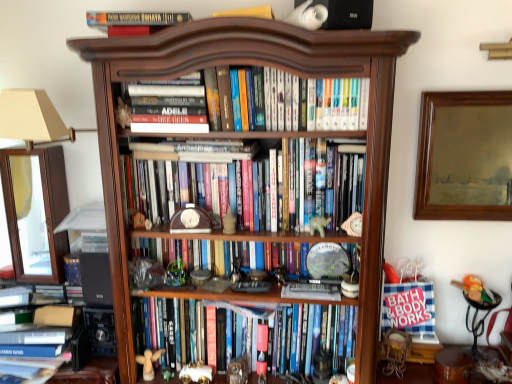
Measure the distance between point (415, 289) and camera.

The depth of point (415, 289) is 1.68 meters.

Identify the location of matte white figurine at center, the fourth toy positioned from the bottom. (350, 285).

In order to click on hardcover book at center, positioned as the 3th book in top-to-bottom order in this screenshot , I will do (168, 105).

The width and height of the screenshot is (512, 384). What do you see at coordinates (464, 156) in the screenshot?
I see `wooden picture frame at upper right` at bounding box center [464, 156].

The width and height of the screenshot is (512, 384). What do you see at coordinates (319, 225) in the screenshot?
I see `white matte bear at center, the second toy when ordered from right to left` at bounding box center [319, 225].

What do you see at coordinates (229, 222) in the screenshot?
I see `matte brown vase at center, arranged as the 4th toy when viewed from the right` at bounding box center [229, 222].

You are a GUI agent. You are given a task and a screenshot of the screen. Output one action in this format:
    pyautogui.click(x=<x>, y=<y>)
    Task: Click on the brown wooden figurine at center, which appears as the fifth toy when viewed from the left
    
    Given the screenshot: What is the action you would take?
    [x=238, y=371]

Is wooden picture frame at upper right facing away from brown wooden clock at center?

No, wooden picture frame at upper right is not facing away from brown wooden clock at center.

Considering the sizes of objects wooden picture frame at upper right and brown wooden clock at center in the image provided, who is wider, wooden picture frame at upper right or brown wooden clock at center?

Wider between the two is wooden picture frame at upper right.

Is wooden picture frame at upper right located outside brown wooden clock at center?

Indeed, wooden picture frame at upper right is completely outside brown wooden clock at center.

Is wooden picture frame at upper right positioned behind brown wooden clock at center?

Yes, it is behind brown wooden clock at center.

Considering the relative sizes of hardcover book at top, which is the first book from top to bottom, and wooden clock at center, marked as the 2th book in a bottom-to-top arrangement, in the image provided, is hardcover book at top, which is the first book from top to bottom, bigger than wooden clock at center, marked as the 2th book in a bottom-to-top arrangement,?

No.

Between hardcover book at top, the sixth book in the bottom-to-top sequence, and wooden clock at center, which is the fifth book from top to bottom, which one has less height?

hardcover book at top, the sixth book in the bottom-to-top sequence.

Is hardcover book at top, which is the first book from top to bottom, with wooden clock at center, which is the fifth book from top to bottom?

No, hardcover book at top, which is the first book from top to bottom, is not with wooden clock at center, which is the fifth book from top to bottom.

Considering the points (98, 12) and (161, 248), which point is in front, point (98, 12) or point (161, 248)?

The point (98, 12) is more forward.

Considering the relative sizes of wooden picture frame at upper right and wooden clock at center, marked as the 2th book in a bottom-to-top arrangement, in the image provided, is wooden picture frame at upper right smaller than wooden clock at center, marked as the 2th book in a bottom-to-top arrangement,?

Yes, wooden picture frame at upper right is smaller than wooden clock at center, marked as the 2th book in a bottom-to-top arrangement.

From the image's perspective, is wooden picture frame at upper right over wooden clock at center, marked as the 2th book in a bottom-to-top arrangement?

Yes, from the image's perspective, wooden picture frame at upper right is above wooden clock at center, marked as the 2th book in a bottom-to-top arrangement.

Considering the relative sizes of wooden picture frame at upper right and wooden clock at center, which is the fifth book from top to bottom, in the image provided, is wooden picture frame at upper right wider than wooden clock at center, which is the fifth book from top to bottom,?

Incorrect, the width of wooden picture frame at upper right does not surpass that of wooden clock at center, which is the fifth book from top to bottom.

Is dark wood bookcase at center far away from brown wooden figurine at upper left, the first toy viewed from the top?

Actually, dark wood bookcase at center and brown wooden figurine at upper left, the first toy viewed from the top, are a little close together.

Does point (381, 114) come farther from viewer compared to point (126, 109)?

No.

Can you confirm if dark wood bookcase at center is smaller than brown wooden figurine at upper left, which appears as the 7th toy when viewed from the right?

No, dark wood bookcase at center is not smaller than brown wooden figurine at upper left, which appears as the 7th toy when viewed from the right.

Is dark wood bookcase at center oriented away from brown wooden figurine at upper left, which appears as the 7th toy when viewed from the right?

Absolutely, dark wood bookcase at center is directed away from brown wooden figurine at upper left, which appears as the 7th toy when viewed from the right.

What's the angular difference between dark wood bookcase at center and hardcover book at top, which is the first book from top to bottom,'s facing directions?

They differ by 10.5 degrees in their facing directions.

Locate an element on the screen. The image size is (512, 384). bookcase below the hardcover book at top, the sixth book in the bottom-to-top sequence (from the image's perspective) is located at coordinates (261, 64).

From their relative heights in the image, would you say dark wood bookcase at center is taller or shorter than hardcover book at top, the sixth book in the bottom-to-top sequence?

dark wood bookcase at center is taller than hardcover book at top, the sixth book in the bottom-to-top sequence.

From a real-world perspective, between dark wood bookcase at center and hardcover book at top, the sixth book in the bottom-to-top sequence, who is vertically lower?

dark wood bookcase at center, from a real-world perspective.

Between brown wooden figurine at upper left, the first toy viewed from the top, and white paper at lower right, which one has smaller size?

brown wooden figurine at upper left, the first toy viewed from the top.

Does brown wooden figurine at upper left, the 1th toy in the left-to-right sequence, have a greater width compared to white paper at lower right?

No.

From a real-world perspective, which is physically above, brown wooden figurine at upper left, the first toy viewed from the top, or white paper at lower right?

brown wooden figurine at upper left, the first toy viewed from the top, is physically above.

Is brown wooden figurine at upper left, the first toy viewed from the top, positioned before white paper at lower right?

Yes, the depth of brown wooden figurine at upper left, the first toy viewed from the top, is less than that of white paper at lower right.

Is wooden picture frame at upper right not near white matte bear at center, which is the third toy from top to bottom?

No, there isn't a large distance between wooden picture frame at upper right and white matte bear at center, which is the third toy from top to bottom.

Does wooden picture frame at upper right contain white matte bear at center, the second toy when ordered from right to left?

Actually, white matte bear at center, the second toy when ordered from right to left, is outside wooden picture frame at upper right.

Considering the sizes of objects wooden picture frame at upper right and white matte bear at center, which is the 6th toy in left-to-right order, in the image provided, who is smaller, wooden picture frame at upper right or white matte bear at center, which is the 6th toy in left-to-right order,?

Smaller between the two is white matte bear at center, which is the 6th toy in left-to-right order.

The height and width of the screenshot is (384, 512). What are the coordinates of `picture frame that is on the right side of brown wooden clock at center` in the screenshot? It's located at (464, 156).

Where is `the 4th book below the hardcover book at top, the sixth book in the bottom-to-top sequence (from a real-world perspective)`? the 4th book below the hardcover book at top, the sixth book in the bottom-to-top sequence (from a real-world perspective) is located at coordinates 226,254.

From the image, which object appears to be farther from dark wood bookcase at center, transparent glass cabinet at left or white paper at lower right?

Based on the image, transparent glass cabinet at left appears to be further to dark wood bookcase at center.

In the scene shown: When comparing their distances from brown wooden figurine at upper left, the first toy viewed from the top, does hardcover book at center, positioned as the 3th book in top-to-bottom order, or wooden angel at lower center, placed as the 2th toy when sorted from left to right, seem closer?

hardcover book at center, positioned as the 3th book in top-to-bottom order, is positioned closer to the anchor brown wooden figurine at upper left, the first toy viewed from the top.

Based on their spatial positions, is white plush toy at lower center, placed as the 5th toy when sorted from right to left, or hardcover books at center, the 2th book viewed from the top, further from brown wooden clock at center?

The object further to brown wooden clock at center is white plush toy at lower center, placed as the 5th toy when sorted from right to left.

Which object lies nearer to the anchor point brown wooden clock at center, brown wooden figurine at center, the sixth toy from the top, or metallic black side table at lower right?

Based on the image, brown wooden figurine at center, the sixth toy from the top, appears to be nearer to brown wooden clock at center.

From the image, which object appears to be farther from hardcover book at center, acting as the 1th book starting from the bottom, brown wooden clock at center or wooden clock at center, marked as the 2th book in a bottom-to-top arrangement?

brown wooden clock at center is further to hardcover book at center, acting as the 1th book starting from the bottom.

Based on their spatial positions, is brown wooden figurine at center, the sixth toy from the top, or transparent glass cabinet at left closer to matte white figurine at center, arranged as the 7th toy when viewed from the left?

brown wooden figurine at center, the sixth toy from the top, is closer to matte white figurine at center, arranged as the 7th toy when viewed from the left.

Looking at the image, which one is located closer to metallic black side table at lower right, hardcover books at center, which appears as the fifth book when ordered from the bottom, or white plush toy at lower center, which is the third toy from left to right?

hardcover books at center, which appears as the fifth book when ordered from the bottom.

From the image, which object appears to be farther from brown wooden figurine at center, which is the 3th toy in right-to-left order, matte white figurine at center, the fourth toy positioned from the bottom, or dark wood bookcase at center?

Among the two, dark wood bookcase at center is located further to brown wooden figurine at center, which is the 3th toy in right-to-left order.

At what (x,y) coordinates should I click in order to perform the action: click on toy between hardcover books at center, positioned as the fourth book in top-to-bottom order, and matte white figurine at center, placed as the 1th toy when sorted from right to left, from left to right. Please return your answer as a coordinate pair (x, y). This screenshot has height=384, width=512. Looking at the image, I should click on (319, 225).

You are a GUI agent. You are given a task and a screenshot of the screen. Output one action in this format:
    pyautogui.click(x=<x>, y=<y>)
    Task: Click on the bookcase between hardcover book at top, which is the first book from top to bottom, and white paper at lower right vertically
    Image resolution: width=512 pixels, height=384 pixels.
    Given the screenshot: What is the action you would take?
    pyautogui.click(x=261, y=64)

Where is `clock between hardcover book at center, positioned as the 3th book in top-to-bottom order, and wooden angel at lower center, the 5th toy from the top, from top to bottom`? Image resolution: width=512 pixels, height=384 pixels. clock between hardcover book at center, positioned as the 3th book in top-to-bottom order, and wooden angel at lower center, the 5th toy from the top, from top to bottom is located at coordinates (190, 220).

Locate an element on the screen. The height and width of the screenshot is (384, 512). paperback book between hardcover book at top, which is the first book from top to bottom, and metallic black side table at lower right, in the horizontal direction is located at coordinates (410, 310).